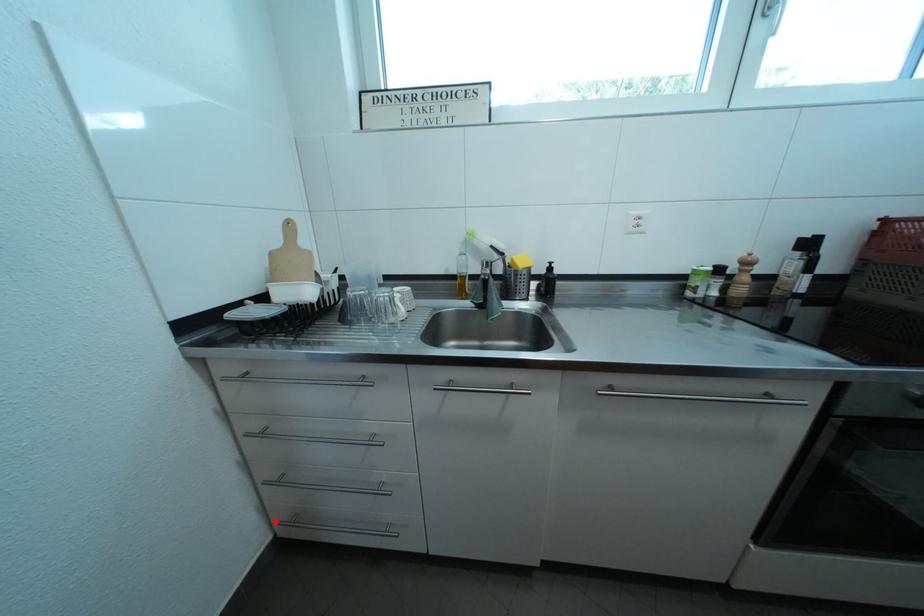
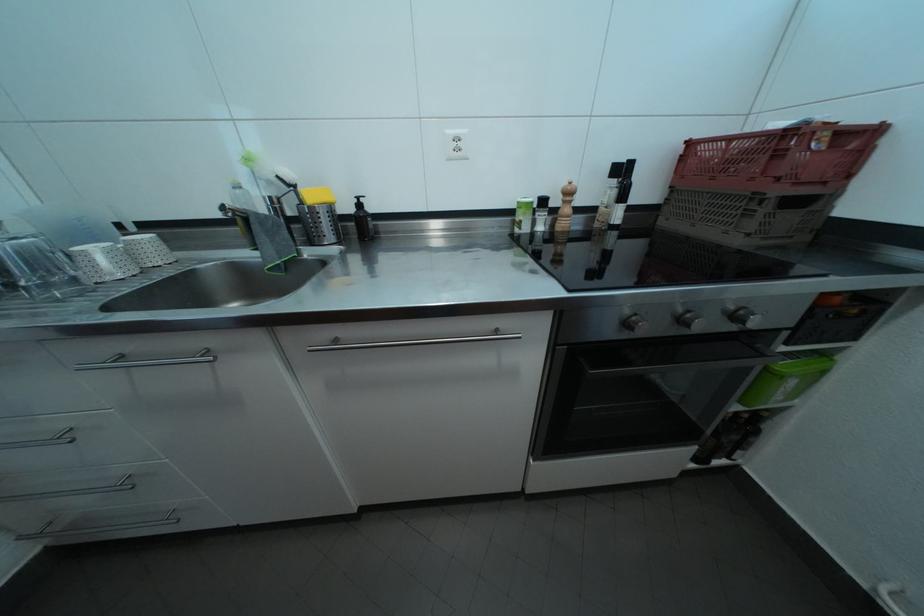
Where in the second image is the point corresponding to the highlighted location from the first image?

(18, 537)